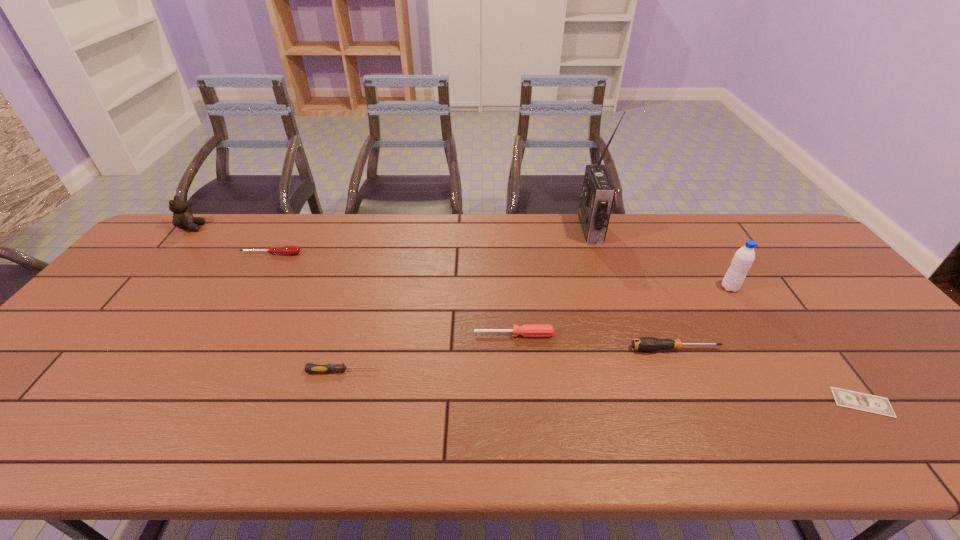
The height and width of the screenshot is (540, 960). What are the coordinates of `the fourth nearest object` in the screenshot? It's located at click(x=527, y=330).

Locate an element on the screen. Image resolution: width=960 pixels, height=540 pixels. the sixth object from right to left is located at coordinates (309, 367).

At what (x,y) coordinates should I click in order to perform the action: click on the nearest screwdriver. Please return your answer as a coordinate pair (x, y). The width and height of the screenshot is (960, 540). Looking at the image, I should click on (309, 367).

I want to click on the rightmost object, so click(x=845, y=398).

Where is `the nearest object`? The image size is (960, 540). the nearest object is located at coordinates (845, 398).

Where is `vacant region located 0.220m on the display of the radio receiver`? vacant region located 0.220m on the display of the radio receiver is located at coordinates (516, 230).

Find the location of a particular element. free space located 0.340m on the display of the radio receiver is located at coordinates pos(481,230).

The height and width of the screenshot is (540, 960). Identify the location of vacant space located on the display of the radio receiver. (484, 230).

At what (x,y) coordinates should I click in order to perform the action: click on vacant region located on the right of the fourth farthest object. Please return your answer as a coordinate pair (x, y). This screenshot has height=540, width=960. Looking at the image, I should click on (831, 288).

Where is `vacant space located 0.070m on the face of the leftmost object`? The image size is (960, 540). vacant space located 0.070m on the face of the leftmost object is located at coordinates (225, 227).